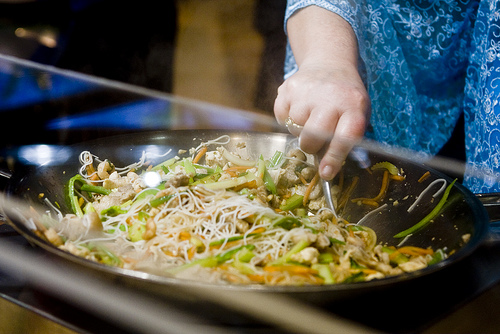
You are a GUI agent. You are given a task and a screenshot of the screen. Output one action in this format:
    pyautogui.click(x=<x>, y=<y>)
    Task: Click on the glass pane
    
    Given the screenshot: What is the action you would take?
    pyautogui.click(x=34, y=118)